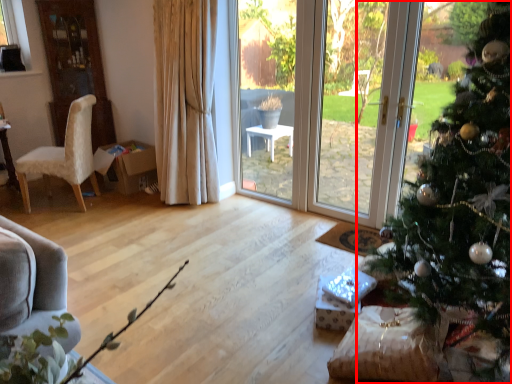
Question: From the image, what is the correct spatial relationship of christmas tree (annotated by the red box) in relation to chair?

Choices:
 (A) left
 (B) right

Answer: (B)